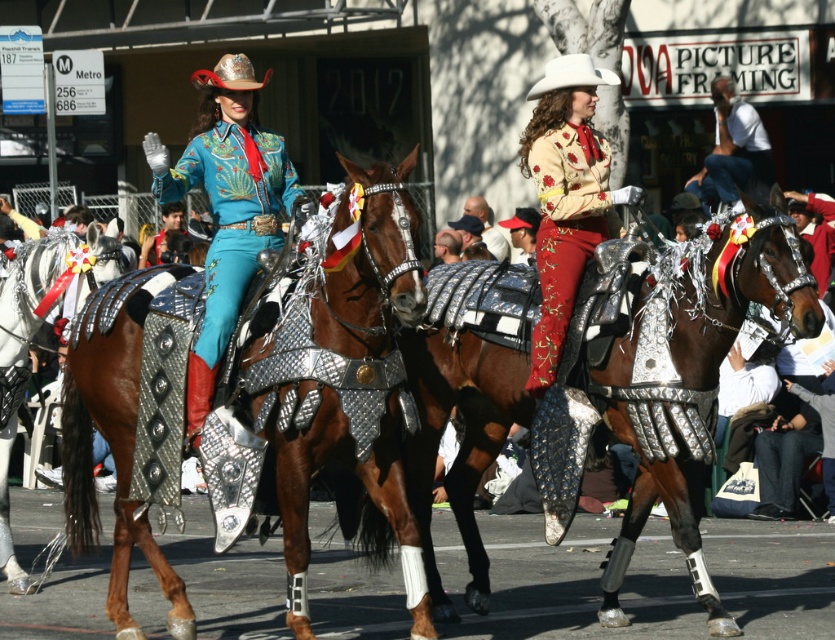
Looking at this image, does shiny silver armor at center come in front of shiny metallic armor at center?

Yes.

Which is more to the right, shiny silver armor at center or shiny metallic armor at center?

Positioned to the right is shiny silver armor at center.

Image resolution: width=835 pixels, height=640 pixels. What are the coordinates of `shiny silver armor at center` in the screenshot? It's located at (696, 384).

Can you confirm if matte teal fabric at center is thinner than white matte cowboy hat at upper center?

Yes.

Identify the location of matte teal fabric at center. This screenshot has width=835, height=640. (226, 205).

The height and width of the screenshot is (640, 835). In order to click on matte teal fabric at center in this screenshot , I will do `click(226, 205)`.

Does point (555, 131) come behind point (19, 272)?

No, it is not.

Is embroidered velvet pants at center closer to the viewer compared to shiny metallic armor at center?

Yes, embroidered velvet pants at center is closer to the viewer.

You are a GUI agent. You are given a task and a screenshot of the screen. Output one action in this format:
    pyautogui.click(x=<x>, y=<y>)
    Task: Click on the embroidered velvet pants at center
    This screenshot has height=640, width=835.
    Given the screenshot: What is the action you would take?
    pyautogui.click(x=564, y=228)

This screenshot has width=835, height=640. What are the coordinates of `embroidered velvet pants at center` in the screenshot? It's located at (564, 228).